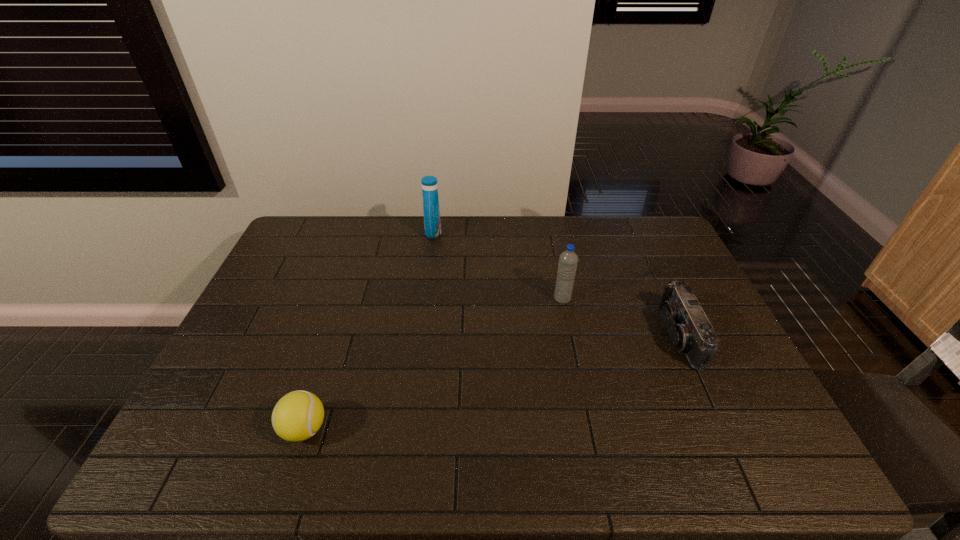
In order to click on the farthest object in this screenshot , I will do (x=432, y=223).

Where is `detergent`? The height and width of the screenshot is (540, 960). detergent is located at coordinates (432, 223).

What are the coordinates of `water bottle` in the screenshot? It's located at (568, 260).

Locate an element on the screen. The image size is (960, 540). camcorder is located at coordinates (689, 329).

This screenshot has width=960, height=540. What are the coordinates of `the leftmost object` in the screenshot? It's located at point(297,416).

I want to click on tennis ball, so click(x=297, y=416).

Image resolution: width=960 pixels, height=540 pixels. What are the coordinates of `vacant area located 0.190m on the front-facing side of the third object from right to left` in the screenshot? It's located at (492, 232).

What are the coordinates of `vacant area located on the left of the water bottle` in the screenshot? It's located at (479, 299).

Where is `vacant region located 0.360m on the front-facing side of the rightmost object`? vacant region located 0.360m on the front-facing side of the rightmost object is located at coordinates (537, 336).

At what (x,y) coordinates should I click in order to perform the action: click on vacant area situated 0.270m on the front-facing side of the rightmost object. Please return your answer as a coordinate pair (x, y). The width and height of the screenshot is (960, 540). Looking at the image, I should click on (568, 336).